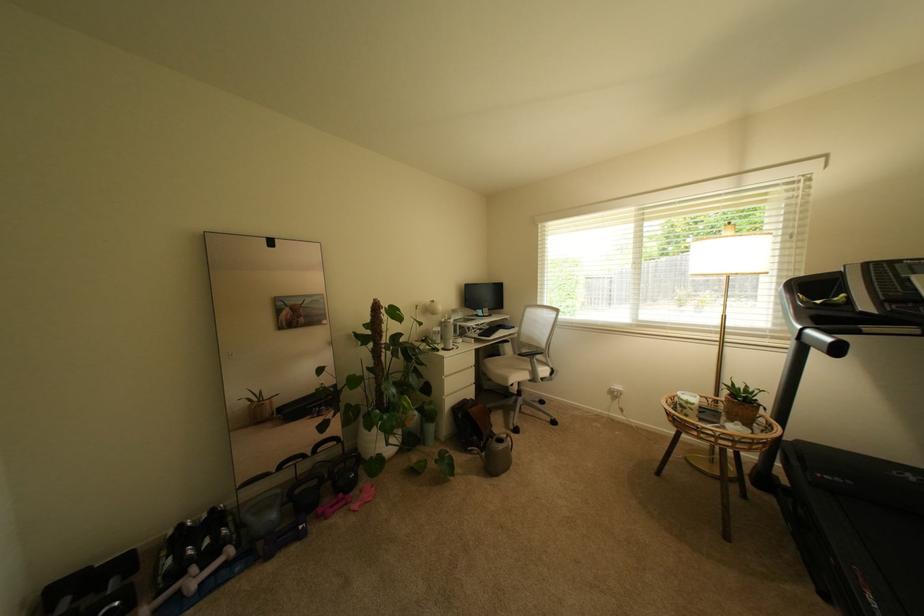
In order to click on white chair sitting surface in this screenshot , I will do [x=512, y=369].